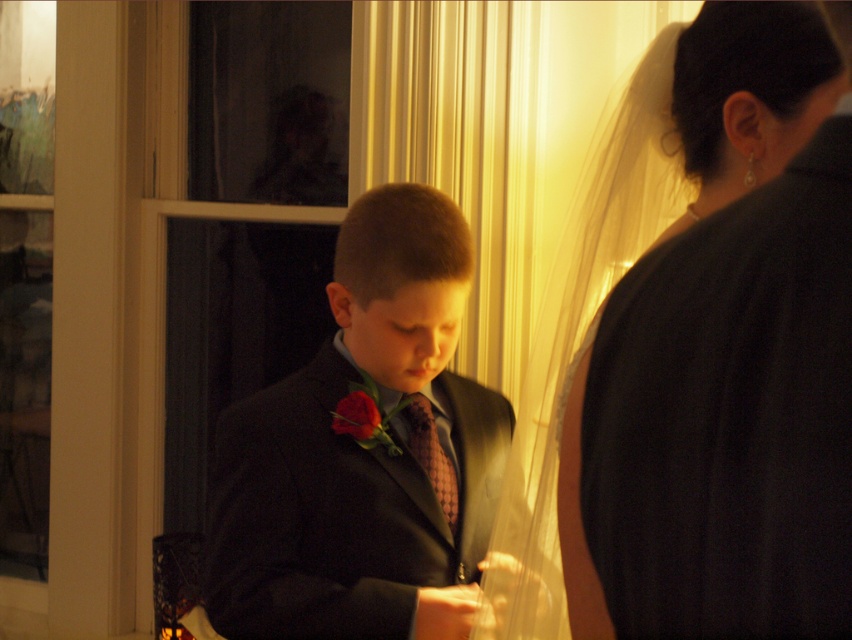
You are planning to place a decorative ribbon on either the silky white veil at upper right or the pink textured tie at center. Since you want the ribbon to be noticeable, which object should you choose and why?

You should choose the silky white veil at upper right because it is larger in size than the pink textured tie at center, making it a better surface for a noticeable decorative ribbon.